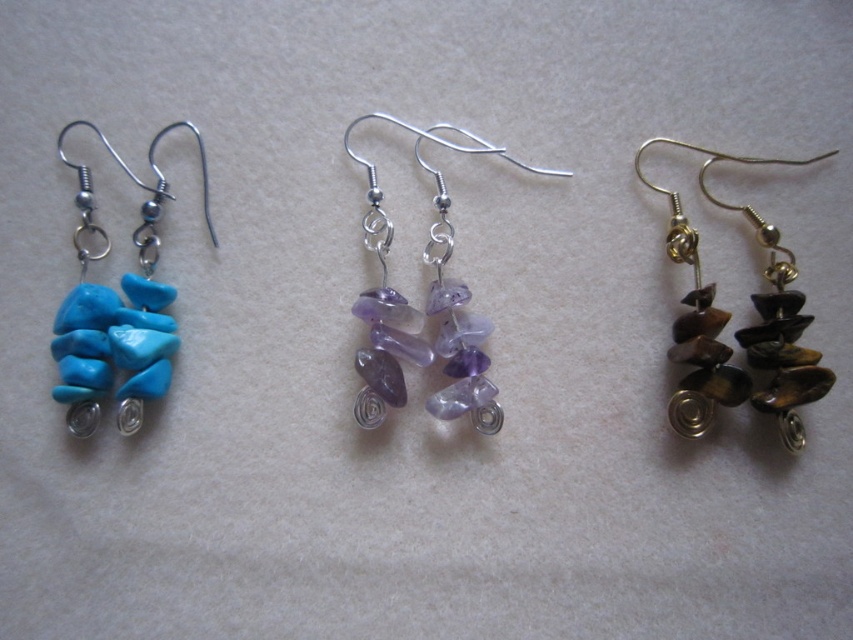
Question: Which object appears farthest from the camera in this image?

Choices:
 (A) turquoise stone earrings at left
 (B) brown polished stone earrings at right
 (C) purple translucent stones at center

Answer: (C)

Question: Which is farther from the turquoise stone earrings at left?

Choices:
 (A) brown polished stone earrings at right
 (B) purple translucent stones at center

Answer: (A)

Question: Is brown polished stone earrings at right below purple translucent stones at center?

Choices:
 (A) no
 (B) yes

Answer: (B)

Question: Can you confirm if brown polished stone earrings at right is positioned above purple translucent stones at center?

Choices:
 (A) yes
 (B) no

Answer: (B)

Question: In this image, where is brown polished stone earrings at right located relative to purple translucent stones at center?

Choices:
 (A) right
 (B) left

Answer: (A)

Question: Estimate the real-world distances between objects in this image. Which object is farther from the brown polished stone earrings at right?

Choices:
 (A) turquoise stone earrings at left
 (B) purple translucent stones at center

Answer: (A)